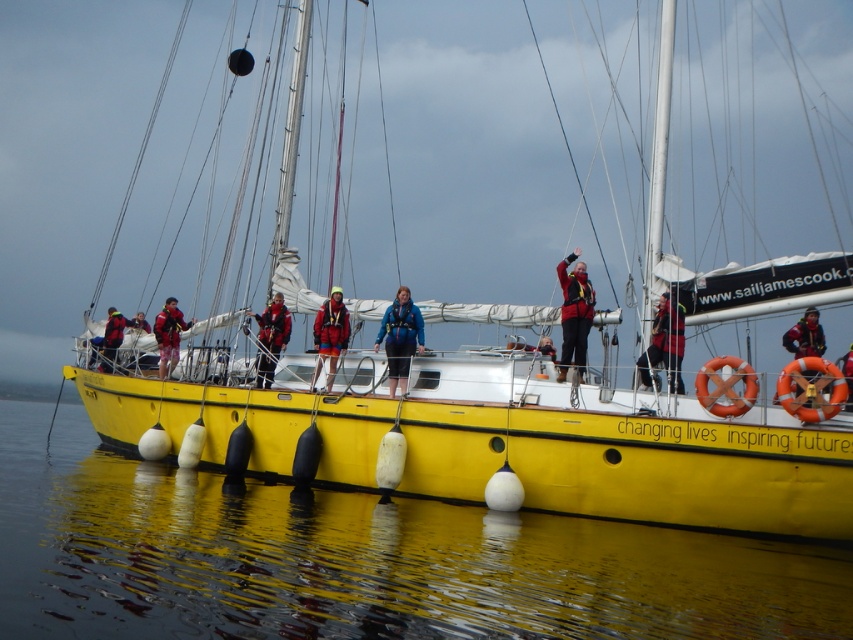
Who is positioned more to the left, red jacket at upper right or matte red jacket at center?

matte red jacket at center

Can you confirm if red jacket at upper right is positioned above matte red jacket at center?

No.

This screenshot has width=853, height=640. Describe the element at coordinates (573, 314) in the screenshot. I see `red jacket at upper right` at that location.

This screenshot has width=853, height=640. Find the location of `red jacket at upper right`. red jacket at upper right is located at coordinates (573, 314).

Locate an element on the screen. glossy water at lower center is located at coordinates (360, 561).

Is point (393, 506) closer to camera compared to point (120, 320)?

Yes, point (393, 506) is in front of point (120, 320).

Which is in front, point (780, 570) or point (108, 340)?

Point (780, 570)

Where is `glossy water at lower center`? glossy water at lower center is located at coordinates [x=360, y=561].

Who is taller, orange rubber life jacket at right or red jacket at center?

Result: With more height is orange rubber life jacket at right.

Can you confirm if orange rubber life jacket at right is positioned below red jacket at center?

Yes.

Locate an element on the screen. orange rubber life jacket at right is located at coordinates [811, 388].

Find the location of a particular element. This screenshot has height=640, width=853. orange rubber life jacket at right is located at coordinates (811, 388).